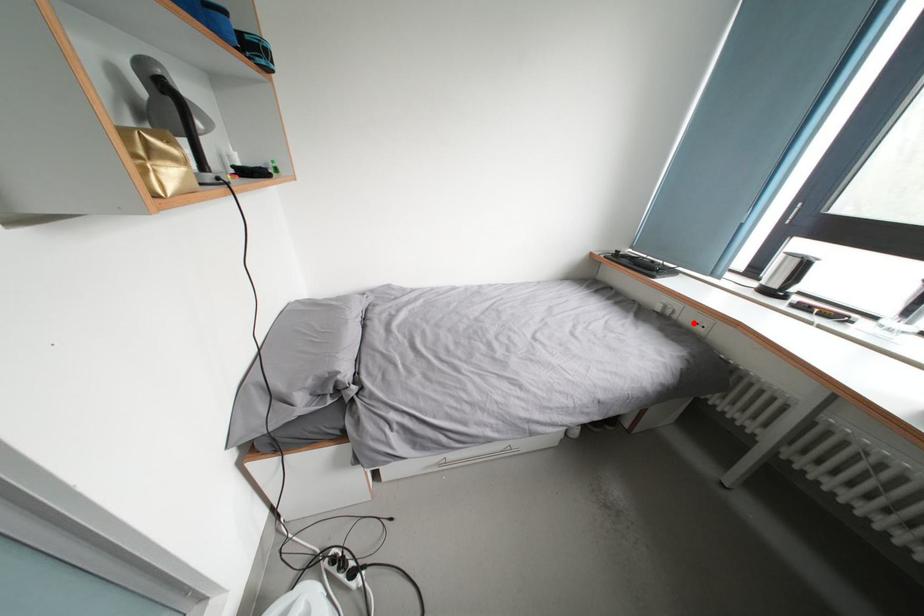
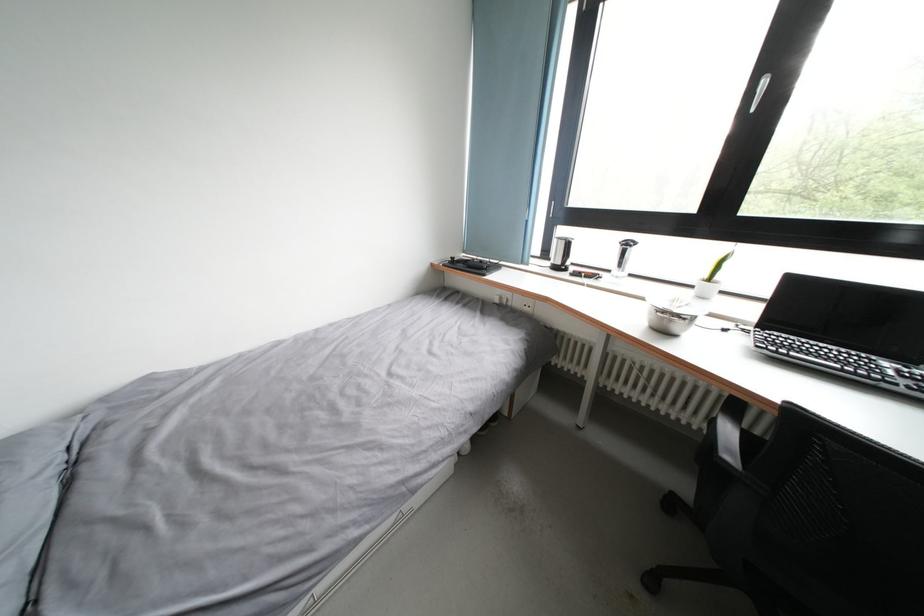
Find the pixel in the second image that matches the highlighted location in the first image.

(524, 308)